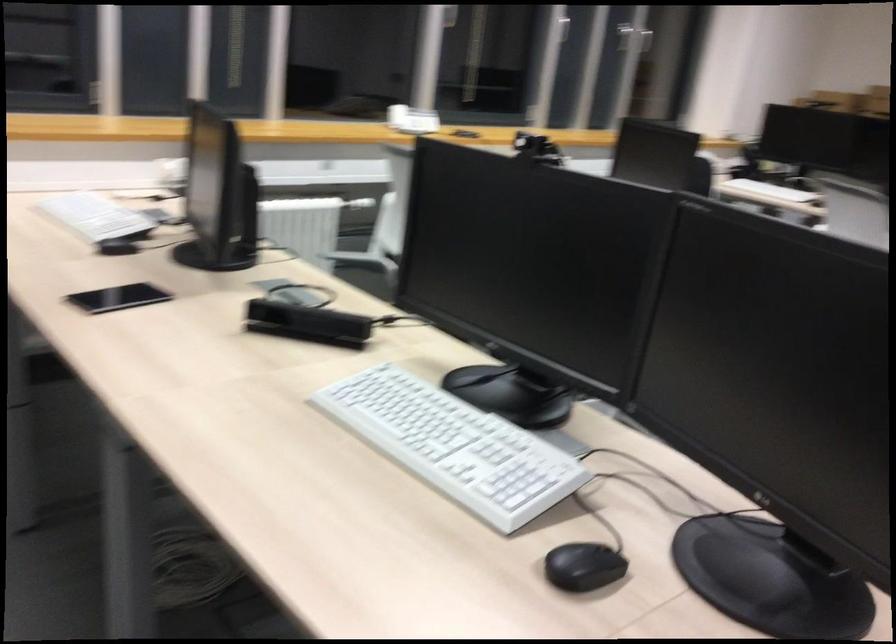
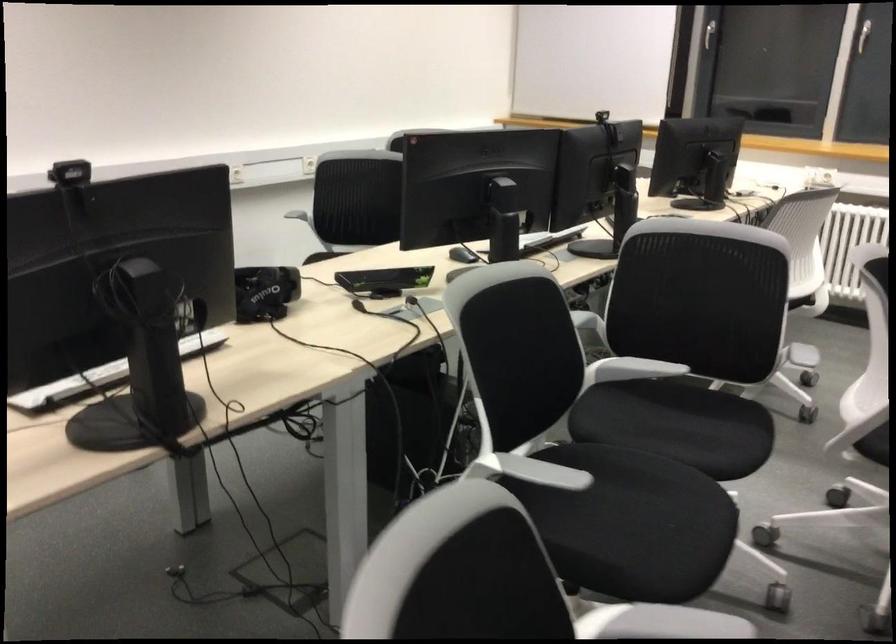
Where in the second image is the point corresponding to pixel 555 552 from the first image?

(462, 254)